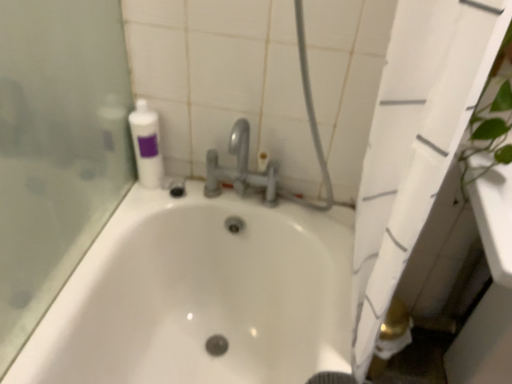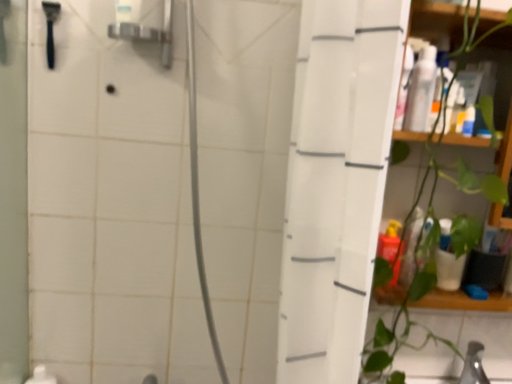
Question: How did the camera likely rotate when shooting the video?

Choices:
 (A) rotated downward
 (B) rotated upward

Answer: (B)